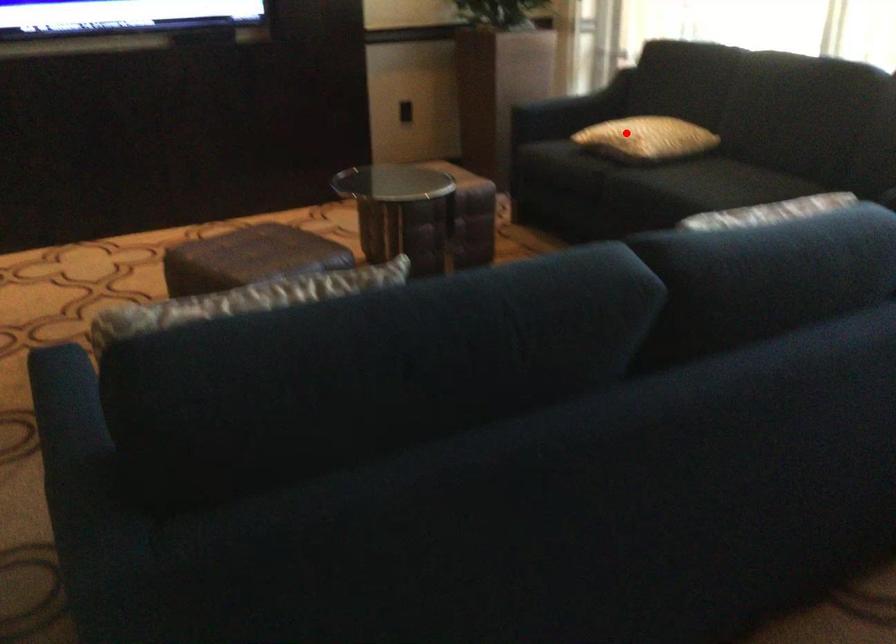
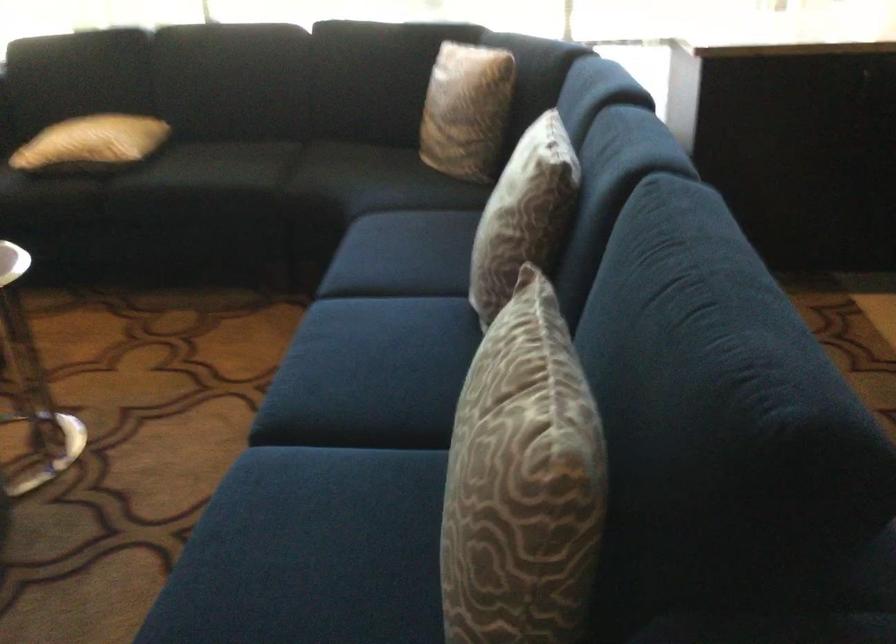
Question: I am providing you with two images of the same scene from different viewpoints. Given a red point in image1, look at the same physical point in image2. Is it:

Choices:
 (A) Closer to the viewpoint
 (B) Farther from the viewpoint

Answer: (A)